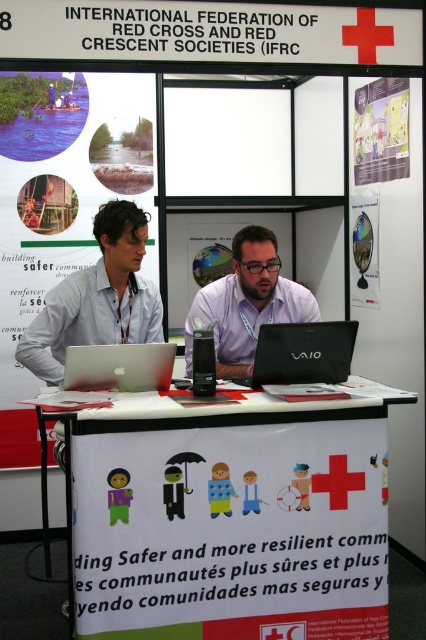
Which is in front, point (78, 189) or point (267, 298)?

Point (267, 298)

Does point (25, 436) come in front of point (278, 280)?

No.

The height and width of the screenshot is (640, 426). I want to click on white paper at upper left, so click(x=60, y=204).

Who is positioned more to the right, matte purple shirt at center or glossy plastic globe at upper right?

From the viewer's perspective, glossy plastic globe at upper right appears more on the right side.

Does matte purple shirt at center appear over glossy plastic globe at upper right?

Incorrect, matte purple shirt at center is not positioned above glossy plastic globe at upper right.

Describe the element at coordinates (247, 304) in the screenshot. The height and width of the screenshot is (640, 426). I see `matte purple shirt at center` at that location.

Image resolution: width=426 pixels, height=640 pixels. What are the coordinates of `matte purple shirt at center` in the screenshot? It's located at (247, 304).

Can you confirm if matte purple shirt at center is taller than black matte laptop at center?

Yes, matte purple shirt at center is taller than black matte laptop at center.

Which is more to the right, matte purple shirt at center or black matte laptop at center?

From the viewer's perspective, black matte laptop at center appears more on the right side.

Locate an element on the screen. matte purple shirt at center is located at coordinates (247, 304).

The image size is (426, 640). Identify the location of matte purple shirt at center. (247, 304).